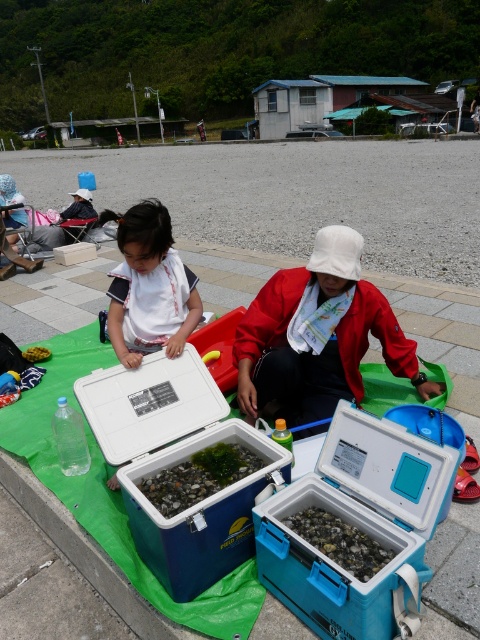
Question: Is blue plastic cooler at center further to camera compared to green matte seaweed at center?

Choices:
 (A) yes
 (B) no

Answer: (B)

Question: Considering the real-world distances, which object is farthest from the green matte seaweed at center?

Choices:
 (A) blue plastic cooler at center
 (B) white cotton shirt at center

Answer: (B)

Question: Observing the image, what is the correct spatial positioning of blue plastic cooler at center in reference to paved stone pavement at center?

Choices:
 (A) below
 (B) above

Answer: (A)

Question: Among these points, which one is nearest to the camera?

Choices:
 (A) (255, 291)
 (B) (239, 467)

Answer: (B)

Question: Is paved stone pavement at center to the right of green matte seaweed at center from the viewer's perspective?

Choices:
 (A) no
 (B) yes

Answer: (A)

Question: Which object appears closest to the camera in this image?

Choices:
 (A) blue plastic cooler at center
 (B) white cotton shirt at center
 (C) paved stone pavement at center

Answer: (A)